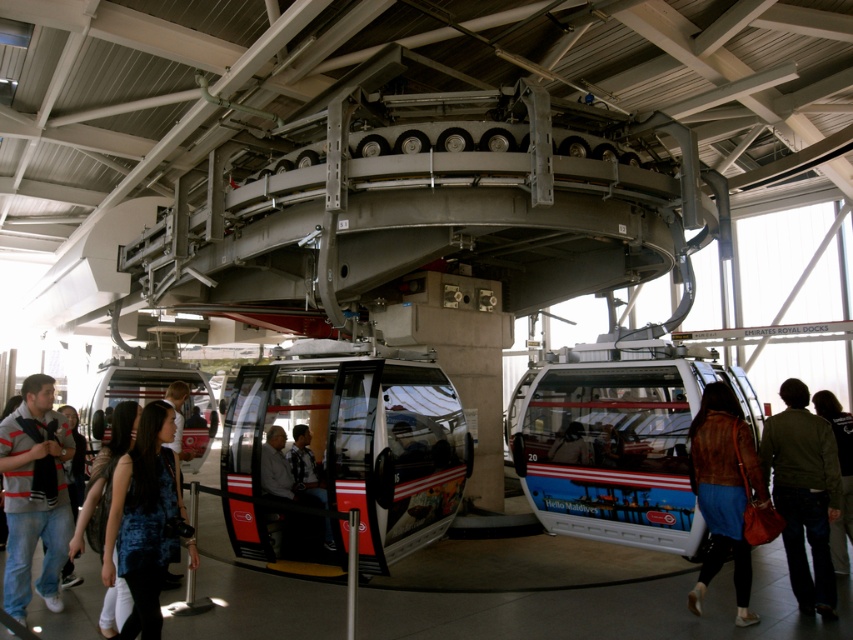
Question: Does green fabric jacket at lower right have a smaller size compared to blue textured shirt at center?

Choices:
 (A) yes
 (B) no

Answer: (B)

Question: Can you confirm if blue fabric dress at lower left is bigger than dark gray fabric jacket at center?

Choices:
 (A) no
 (B) yes

Answer: (B)

Question: Does dark gray fabric jacket at center appear over blue textured shirt at center?

Choices:
 (A) no
 (B) yes

Answer: (A)

Question: Which object is the closest to the shiny metallic cable car at center?

Choices:
 (A) red glossy cable car at center
 (B) dark green jacket at lower right
 (C) matte white cable car at center
 (D) matte gray jacket at center

Answer: (D)

Question: Which object is farther from the camera taking this photo?

Choices:
 (A) dark gray fabric jacket at center
 (B) dark green jacket at lower right

Answer: (A)

Question: Which point appears closest to the camera in this image?

Choices:
 (A) [x=318, y=488]
 (B) [x=636, y=516]

Answer: (B)